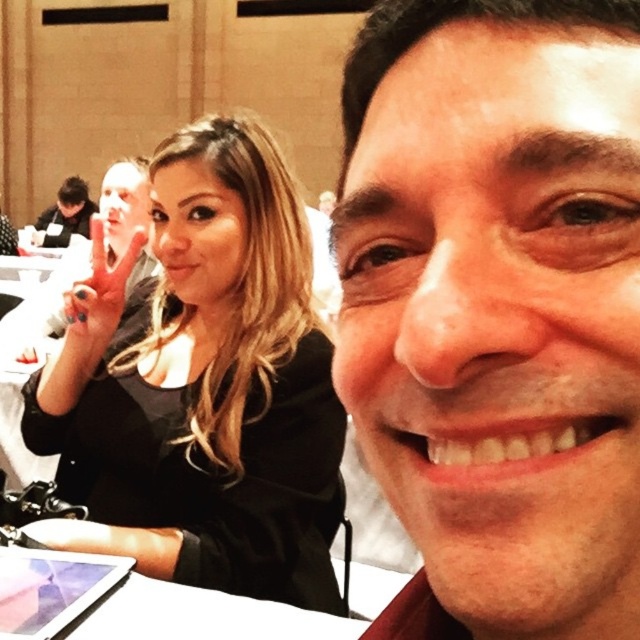
Which is behind, point (573, 392) or point (168, 568)?

Point (168, 568)

Based on the photo, does smooth skin face at center have a greater width compared to black matte hair at upper left?

In fact, smooth skin face at center might be narrower than black matte hair at upper left.

Is point (625, 275) less distant than point (300, 481)?

Yes, point (625, 275) is in front of point (300, 481).

Where is `smooth skin face at center`? The width and height of the screenshot is (640, 640). smooth skin face at center is located at coordinates (497, 307).